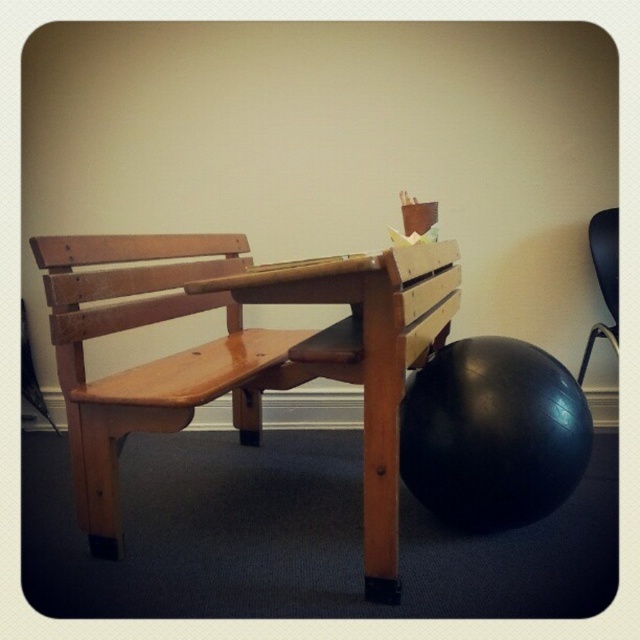
Question: Which object is the farthest from the wooden bench at center?

Choices:
 (A) black rubber ball at lower right
 (B) black matte chair at right
 (C) light brown wood bench at center

Answer: (B)

Question: Considering the real-world distances, which object is closest to the wooden bench at center?

Choices:
 (A) light brown wood bench at center
 (B) black rubber ball at lower right
 (C) black matte chair at right

Answer: (B)

Question: Is wooden bench at center bigger than black rubber ball at lower right?

Choices:
 (A) yes
 (B) no

Answer: (A)

Question: Is light brown wood bench at center to the right of wooden bench at center from the viewer's perspective?

Choices:
 (A) yes
 (B) no

Answer: (B)

Question: Can you confirm if wooden bench at center is positioned to the right of black rubber ball at lower right?

Choices:
 (A) no
 (B) yes

Answer: (A)

Question: Which object is farther from the camera taking this photo?

Choices:
 (A) black rubber ball at lower right
 (B) black matte chair at right
 (C) light brown wood bench at center

Answer: (B)